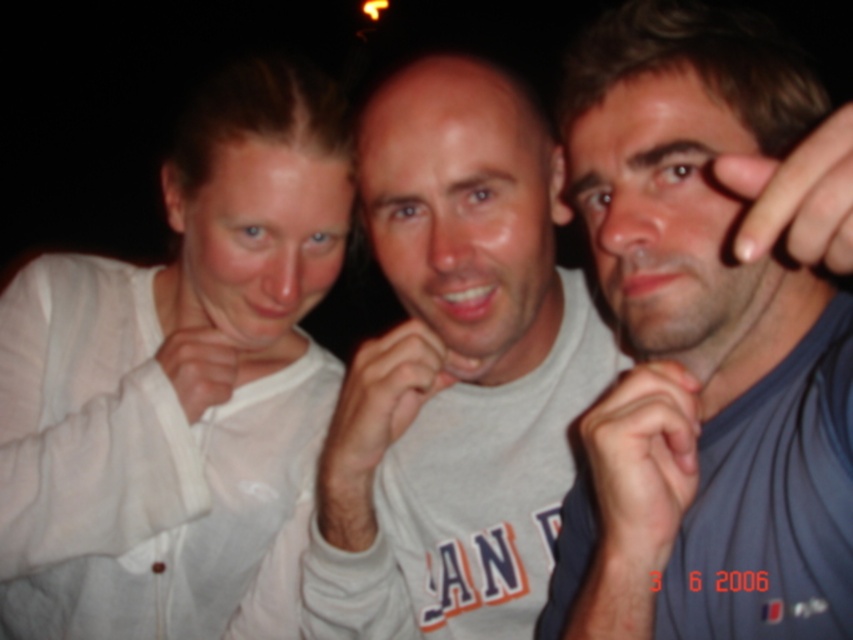
Is blue fabric shirt at right behind white matte hand at center?

No, it is not.

Locate an element on the screen. This screenshot has width=853, height=640. blue fabric shirt at right is located at coordinates (701, 346).

Which is in front, point (782, 58) or point (357, 454)?

Point (782, 58)

The width and height of the screenshot is (853, 640). Identify the location of blue fabric shirt at right. (701, 346).

Does blue fabric shirt at right have a smaller size compared to white sheer shirt at left?

Indeed, blue fabric shirt at right has a smaller size compared to white sheer shirt at left.

Does point (833, 593) come in front of point (33, 307)?

Yes, it is in front of point (33, 307).

The image size is (853, 640). What do you see at coordinates (701, 346) in the screenshot?
I see `blue fabric shirt at right` at bounding box center [701, 346].

The height and width of the screenshot is (640, 853). Find the location of `blue fabric shirt at right`. blue fabric shirt at right is located at coordinates (701, 346).

Can you confirm if nail polish at upper right is positioned to the right of white fabric hand at center?

Correct, you'll find nail polish at upper right to the right of white fabric hand at center.

Does nail polish at upper right have a lesser height compared to white fabric hand at center?

In fact, nail polish at upper right may be taller than white fabric hand at center.

The image size is (853, 640). I want to click on nail polish at upper right, so click(798, 196).

Identify the location of nail polish at upper right. (798, 196).